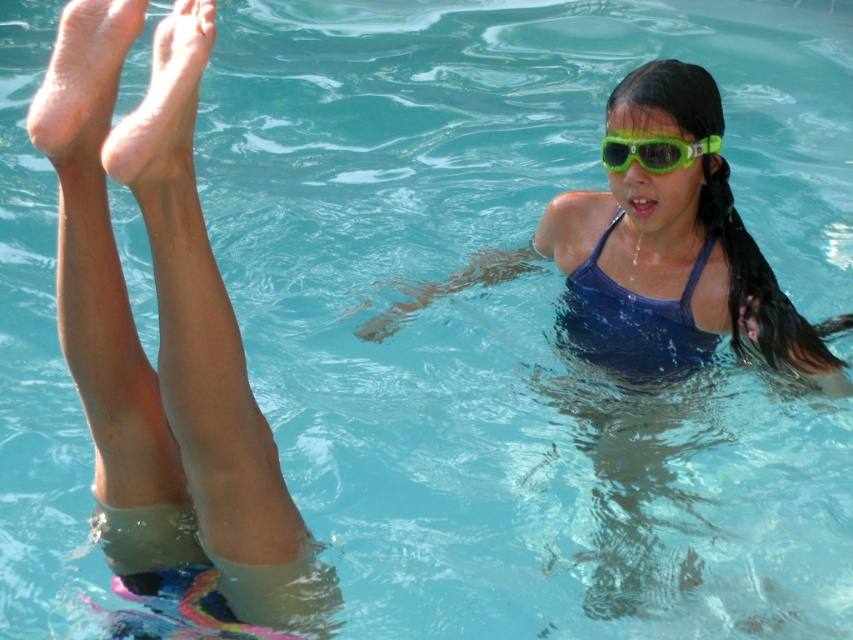
Question: Is smooth skin legs at upper left closer to the viewer compared to pale skin feet at upper left?

Choices:
 (A) no
 (B) yes

Answer: (B)

Question: Is smooth skin legs at upper left further to camera compared to green matte goggles at upper center?

Choices:
 (A) yes
 (B) no

Answer: (B)

Question: Which is farther from the smooth skin legs at upper left?

Choices:
 (A) green matte goggles at upper center
 (B) pale skin feet at upper left
 (C) blue fabric swimsuit at center
 (D) dry skin foot at upper left

Answer: (A)

Question: Which point appears closest to the camera in this image?

Choices:
 (A) (610, 166)
 (B) (115, 342)
 (C) (85, 138)

Answer: (C)

Question: Estimate the real-world distances between objects in this image. Which object is closer to the blue fabric swimsuit at center?

Choices:
 (A) dry skin foot at upper left
 (B) pale skin feet at upper left
 (C) green matte goggles at upper center

Answer: (C)

Question: Is the position of blue fabric swimsuit at center more distant than that of green matte goggles at upper center?

Choices:
 (A) yes
 (B) no

Answer: (A)